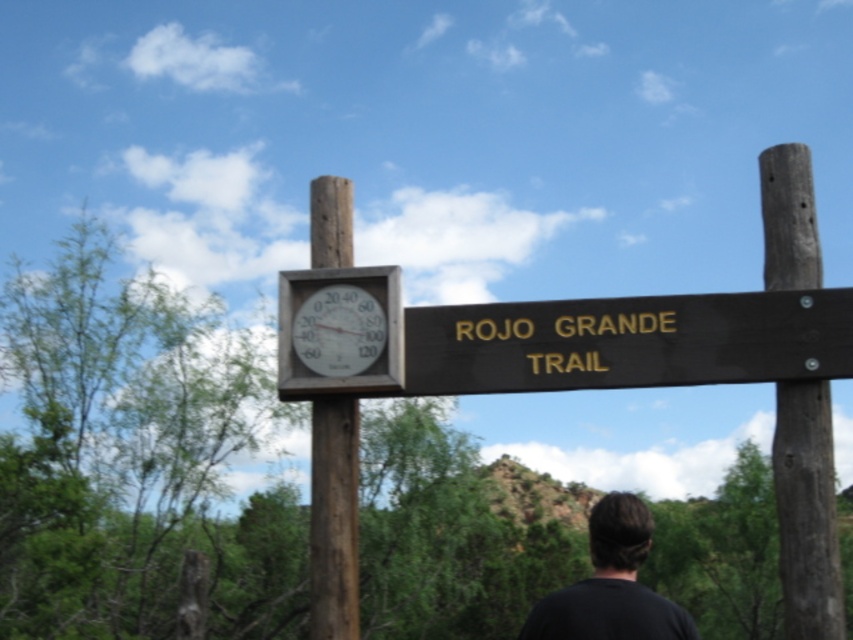
Question: Is the position of brown rough wood pole at center more distant than that of white plastic clock at upper center?

Choices:
 (A) yes
 (B) no

Answer: (B)

Question: Which object appears farthest from the camera in this image?

Choices:
 (A) brown rough wood pole at center
 (B) brown wooden sign at center
 (C) brown wood post at right
 (D) black matte shirt at lower center

Answer: (C)

Question: Which object appears closest to the camera in this image?

Choices:
 (A) brown wood post at right
 (B) white plastic clock at upper center
 (C) brown wooden sign at center
 (D) black matte shirt at lower center

Answer: (D)

Question: Estimate the real-world distances between objects in this image. Which object is closer to the brown rough wood pole at center?

Choices:
 (A) white plastic clock at upper center
 (B) black matte shirt at lower center
 (C) brown wooden sign at center
 (D) brown wood post at right

Answer: (A)

Question: Does brown wooden sign at center have a smaller size compared to white plastic clock at upper center?

Choices:
 (A) yes
 (B) no

Answer: (B)

Question: Can you confirm if brown wood post at right is wider than black matte shirt at lower center?

Choices:
 (A) yes
 (B) no

Answer: (B)